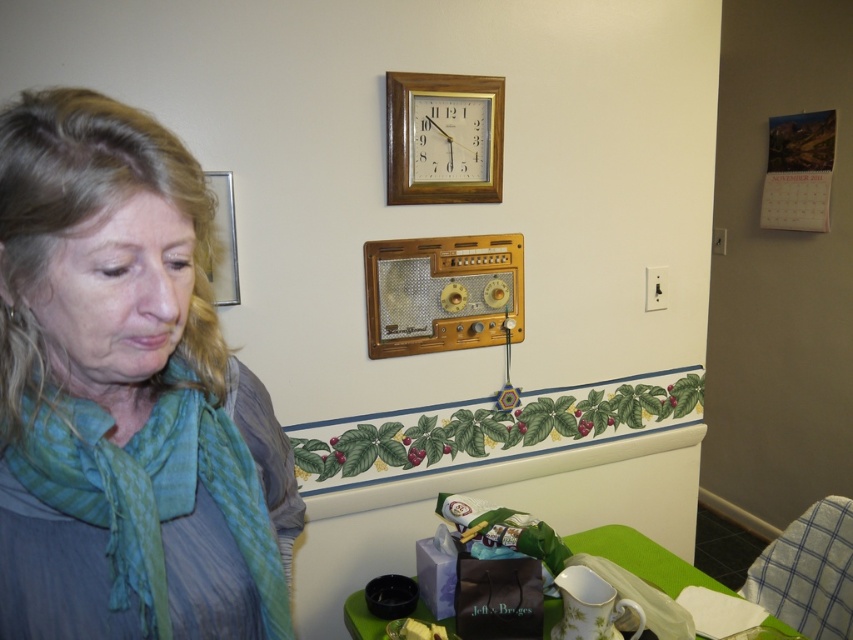
Who is more distant from viewer, [473,189] or [773,620]?

The point [473,189] is behind.

Who is shorter, gold-framed clock at upper center or matte purple paper bag at lower center?

With less height is matte purple paper bag at lower center.

Between point (419, 115) and point (671, 557), which one is positioned in front?

Point (419, 115) is more forward.

Identify the location of gold-framed clock at upper center. (444, 138).

Is gold-framed clock at upper center to the right of metallic silver picture frame at upper left from the viewer's perspective?

Correct, you'll find gold-framed clock at upper center to the right of metallic silver picture frame at upper left.

How much distance is there between gold-framed clock at upper center and metallic silver picture frame at upper left?

The distance of gold-framed clock at upper center from metallic silver picture frame at upper left is 20.69 inches.

Locate an element on the screen. The width and height of the screenshot is (853, 640). gold-framed clock at upper center is located at coordinates (444, 138).

You are a GUI agent. You are given a task and a screenshot of the screen. Output one action in this format:
    pyautogui.click(x=<x>, y=<y>)
    Task: Click on the gold-framed clock at upper center
    
    Given the screenshot: What is the action you would take?
    pyautogui.click(x=444, y=138)

Is teal silk scarf at left bigger than metallic silver picture frame at upper left?

Yes, teal silk scarf at left is bigger than metallic silver picture frame at upper left.

Is the position of teal silk scarf at left less distant than that of metallic silver picture frame at upper left?

Yes, teal silk scarf at left is closer to the viewer.

Where is `teal silk scarf at left`? This screenshot has width=853, height=640. teal silk scarf at left is located at coordinates (154, 518).

The height and width of the screenshot is (640, 853). What are the coordinates of `teal silk scarf at left` in the screenshot? It's located at (154, 518).